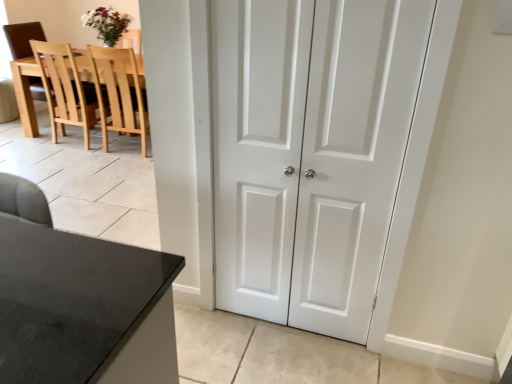
Question: From a real-world perspective, is light wood chair at upper left, arranged as the first chair when viewed from the right, located beneath white smooth door at center?

Choices:
 (A) no
 (B) yes

Answer: (B)

Question: Is light wood chair at upper left, arranged as the first chair when viewed from the right, looking in the opposite direction of white smooth door at center?

Choices:
 (A) no
 (B) yes

Answer: (A)

Question: Is light wood chair at upper left, the second chair viewed from the left, at the right side of white smooth door at center?

Choices:
 (A) no
 (B) yes

Answer: (A)

Question: Could white smooth door at center be considered to be inside light wood chair at upper left, arranged as the first chair when viewed from the right?

Choices:
 (A) yes
 (B) no

Answer: (B)

Question: Can you confirm if light wood chair at upper left, the second chair viewed from the left, is taller than white smooth door at center?

Choices:
 (A) yes
 (B) no

Answer: (B)

Question: From a real-world perspective, is light brown wood chair at left, which is counted as the first chair, starting from the left, positioned above or below white matte door at center?

Choices:
 (A) above
 (B) below

Answer: (B)

Question: Would you say light brown wood chair at left, the 2th chair in the right-to-left sequence, is inside or outside white matte door at center?

Choices:
 (A) outside
 (B) inside

Answer: (A)

Question: Considering the relative positions of light brown wood chair at left, which is counted as the first chair, starting from the left, and white matte door at center in the image provided, is light brown wood chair at left, which is counted as the first chair, starting from the left, to the left or to the right of white matte door at center?

Choices:
 (A) right
 (B) left

Answer: (B)

Question: Is light brown wood chair at left, the 2th chair in the right-to-left sequence, wider or thinner than white matte door at center?

Choices:
 (A) thin
 (B) wide

Answer: (B)

Question: Choose the correct answer: Is white matte door at center inside light brown wood chair at left, which is counted as the first chair, starting from the left, or outside it?

Choices:
 (A) outside
 (B) inside

Answer: (A)

Question: Is white matte door at center taller or shorter than light brown wood chair at left, which is counted as the first chair, starting from the left?

Choices:
 (A) short
 (B) tall

Answer: (B)

Question: From the image's perspective, is white matte door at center located above or below light brown wood chair at left, which is counted as the first chair, starting from the left?

Choices:
 (A) above
 (B) below

Answer: (B)

Question: In terms of width, does white matte door at center look wider or thinner when compared to light brown wood chair at left, which is counted as the first chair, starting from the left?

Choices:
 (A) thin
 (B) wide

Answer: (A)

Question: Visually, is light wood chair at upper left, the second chair viewed from the left, positioned to the left or to the right of white matte door at center?

Choices:
 (A) right
 (B) left

Answer: (B)

Question: From the image's perspective, is light wood chair at upper left, arranged as the first chair when viewed from the right, positioned above or below white matte door at center?

Choices:
 (A) above
 (B) below

Answer: (A)